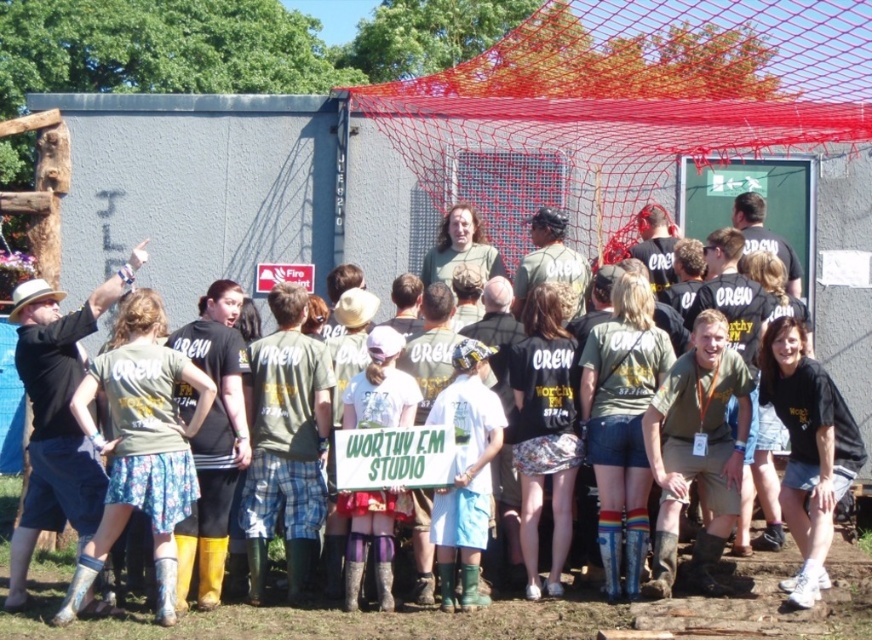
Question: Considering the relative positions of floral skirt at center and white matte shirt at center in the image provided, where is floral skirt at center located with respect to white matte shirt at center?

Choices:
 (A) right
 (B) left

Answer: (B)

Question: Which object is positioned closest to the white plastic sign at center?

Choices:
 (A) black matte t-shirt at lower right
 (B) red mesh net at upper center
 (C) white matte shirt at center
 (D) floral skirt at center

Answer: (D)

Question: Can you confirm if red mesh net at upper center is wider than white matte t-shirt at center?

Choices:
 (A) yes
 (B) no

Answer: (A)

Question: Among these points, which one is nearest to the camera?

Choices:
 (A) (379, 368)
 (B) (549, 108)
 (C) (169, 376)
 (D) (259, 262)

Answer: (C)

Question: Based on their relative distances, which object is farther from the floral skirt at center?

Choices:
 (A) white matte t-shirt at center
 (B) white plastic sign at center

Answer: (B)

Question: Does matte green t-shirt at center have a greater width compared to white plastic sign at center?

Choices:
 (A) no
 (B) yes

Answer: (B)